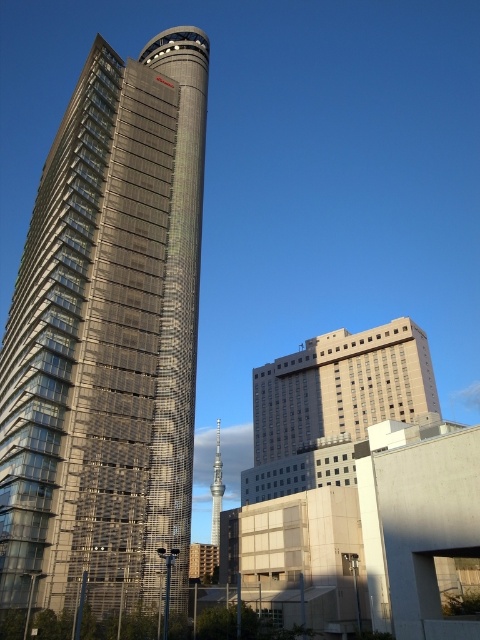
Question: Which object appears closest to the camera in this image?

Choices:
 (A) glassy metallic tower at center
 (B) beige concrete building at center
 (C) metallic glass skyscraper at center

Answer: (C)

Question: Can you confirm if beige concrete building at center is positioned to the left of glassy metallic tower at center?

Choices:
 (A) no
 (B) yes

Answer: (A)

Question: Is beige concrete building at center wider than glassy metallic tower at center?

Choices:
 (A) no
 (B) yes

Answer: (B)

Question: Is beige concrete building at center above glassy metallic tower at center?

Choices:
 (A) no
 (B) yes

Answer: (B)

Question: Which point is farther to the camera?

Choices:
 (A) glassy metallic tower at center
 (B) metallic glass skyscraper at center

Answer: (A)

Question: Which of these objects is positioned farthest from the glassy metallic tower at center?

Choices:
 (A) beige concrete building at center
 (B) metallic glass skyscraper at center

Answer: (B)